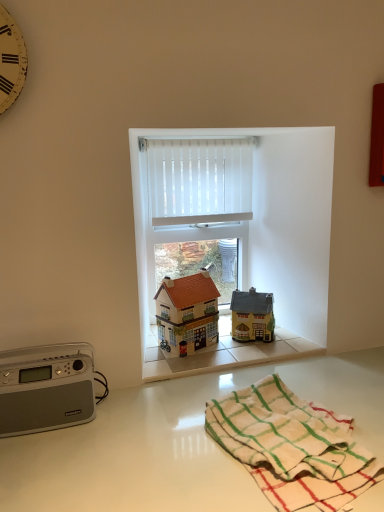
Where is `free area in between matte brown house at center, which ranks as the 1th toy in left-to-right order, and matte yellow house at center, the second toy viewed from the left`? This screenshot has width=384, height=512. free area in between matte brown house at center, which ranks as the 1th toy in left-to-right order, and matte yellow house at center, the second toy viewed from the left is located at coordinates (223, 346).